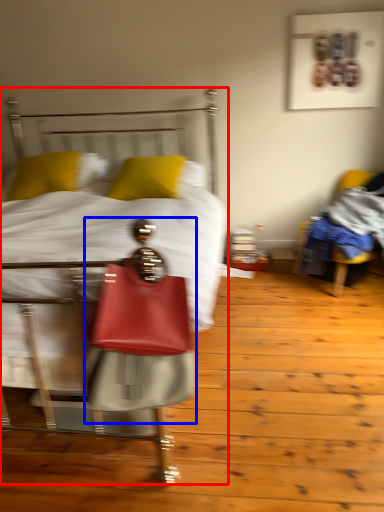
Question: Among these objects, which one is nearest to the camera, bed (highlighted by a red box) or person (highlighted by a blue box)?

Choices:
 (A) bed
 (B) person

Answer: (A)